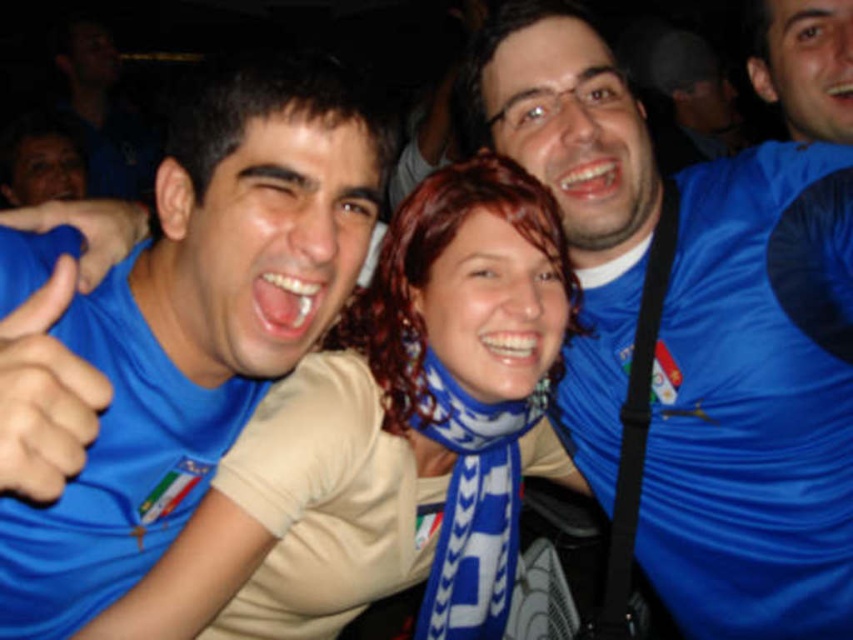
You are a photographer at the event and want to capture a closeup of the white textured scarf at center and the blue fabric hand at center. Since the scarf is larger, which object should you focus on to ensure both fit in the frame?

The white textured scarf at center is larger than the blue fabric hand at center, so focusing on the scarf will ensure both fit in the frame.

You are standing in the crowd at this sports event and want to take a photo of both the point at position (769, 333) and the point at position (45, 408). Which point is closer to your camera lens?

Point (45, 408) is closer to the camera lens because it is less further away than point (769, 333).

You are a photographer at the event and want to capture a photo where both the white textured scarf at center and the blue fabric hand at center are clearly visible. Based on their positions, which object should appear closer to the camera?

The white textured scarf at center appears closer to the camera because the blue fabric hand at center is behind it.